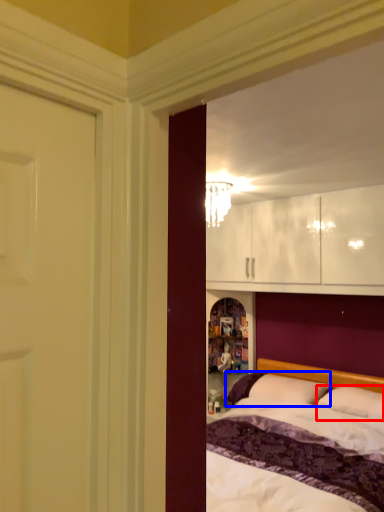
Question: Which of the following is the closest to the observer, pillow (highlighted by a red box) or pillow (highlighted by a blue box)?

Choices:
 (A) pillow
 (B) pillow

Answer: (A)